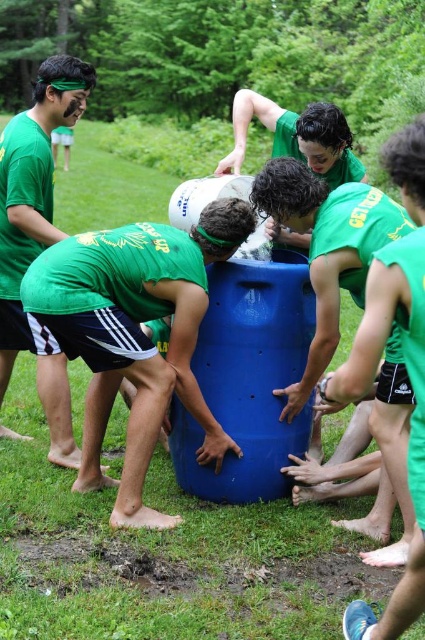
Question: Among these points, which one is nearest to the camera?

Choices:
 (A) (176, 324)
 (B) (34, 104)

Answer: (A)

Question: Observing the image, what is the correct spatial positioning of matte blue barrel at center in reference to matte green t-shirt at upper left?

Choices:
 (A) below
 (B) above

Answer: (A)

Question: Observing the image, what is the correct spatial positioning of matte blue barrel at center in reference to matte green t-shirt at upper left?

Choices:
 (A) right
 (B) left

Answer: (A)

Question: Which object appears closest to the camera in this image?

Choices:
 (A) matte blue barrel at center
 (B) matte green t-shirt at upper left

Answer: (A)

Question: Can you confirm if matte blue barrel at center is bigger than matte green t-shirt at upper left?

Choices:
 (A) no
 (B) yes

Answer: (B)

Question: Among these objects, which one is nearest to the camera?

Choices:
 (A) matte green t-shirt at upper left
 (B) matte blue barrel at center

Answer: (B)